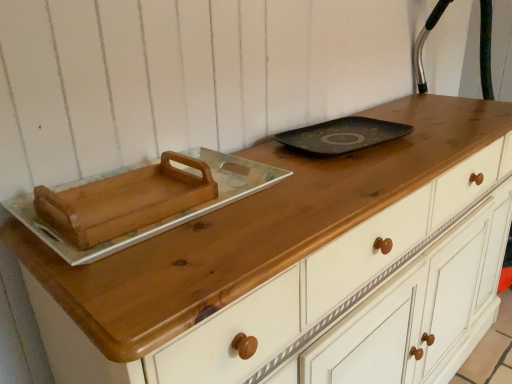
You are a GUI agent. You are given a task and a screenshot of the screen. Output one action in this format:
    pyautogui.click(x=<x>, y=<y>)
    Task: Click on the vacant point to the right of wooden tray at left
    This screenshot has height=384, width=512.
    Given the screenshot: What is the action you would take?
    pyautogui.click(x=273, y=216)